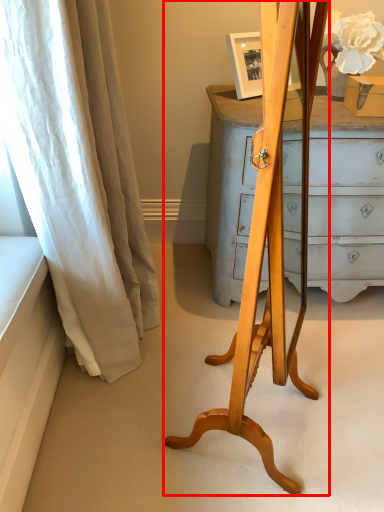
Question: Observing the image, what is the correct spatial positioning of easel (annotated by the red box) in reference to curtain?

Choices:
 (A) left
 (B) right

Answer: (B)